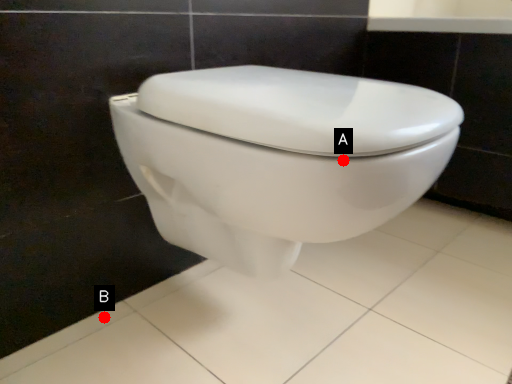
Question: Two points are circled on the image, labeled by A and B beside each circle. Which point appears closest to the camera in this image?

Choices:
 (A) A is closer
 (B) B is closer

Answer: (A)